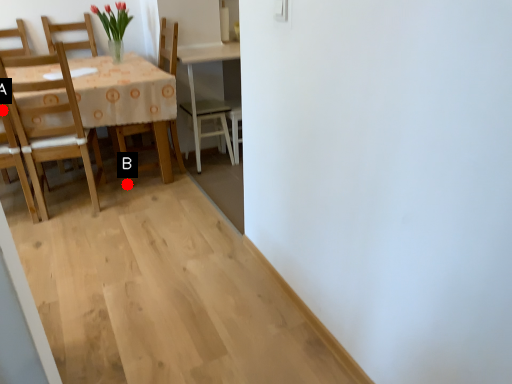
Question: Two points are circled on the image, labeled by A and B beside each circle. Which point is further to the camera?

Choices:
 (A) A is further
 (B) B is further

Answer: (B)